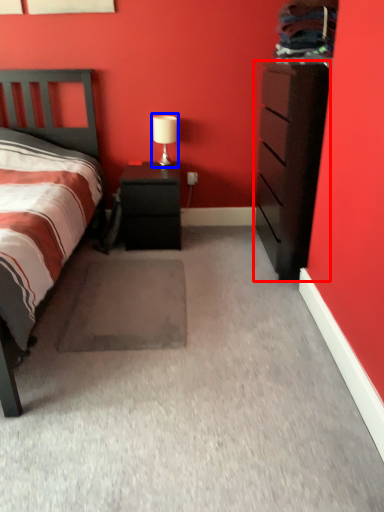
Question: Among these objects, which one is nearest to the camera, chest of drawers (highlighted by a red box) or table lamp (highlighted by a blue box)?

Choices:
 (A) chest of drawers
 (B) table lamp

Answer: (A)